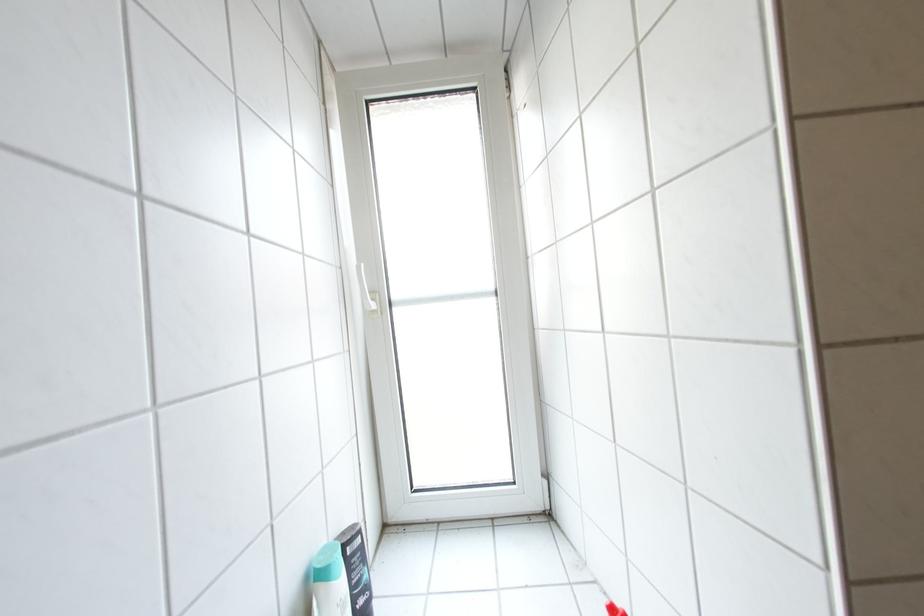
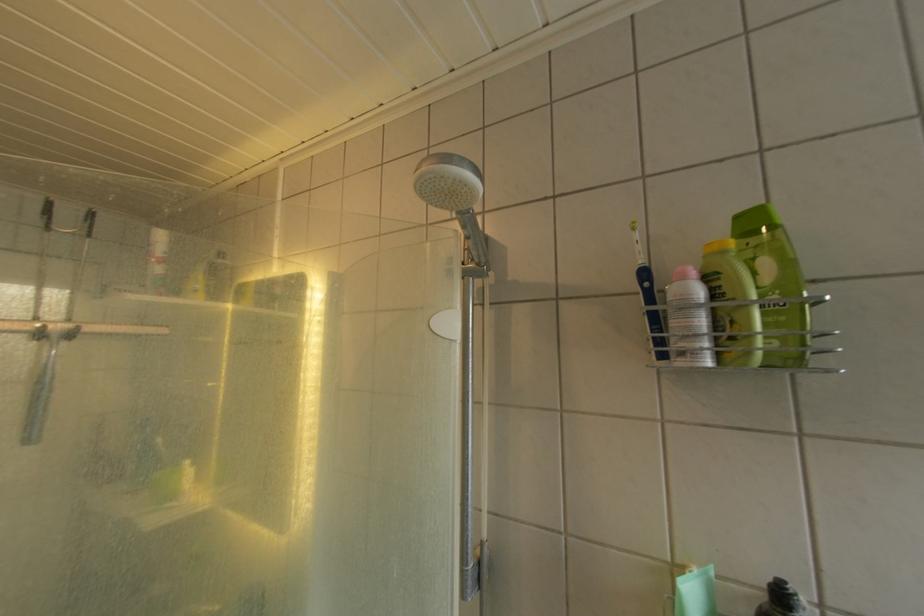
Question: Based on the continuous images, in which direction is the camera rotating? Reply with the corresponding letter.

Choices:
 (A) Left
 (B) Right
 (C) Up
 (D) Down

Answer: (A)